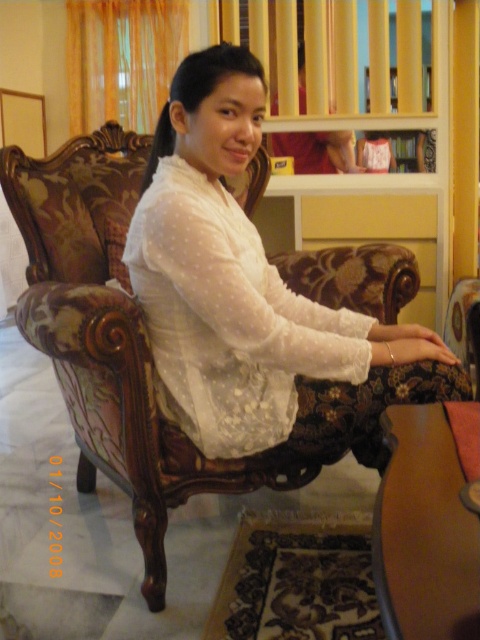
Question: Which of the following is the closest to the observer?

Choices:
 (A) wooden bookshelf at upper center
 (B) white sheer dress at center

Answer: (A)

Question: Among these points, which one is nearest to the camera?

Choices:
 (A) (287, 406)
 (B) (371, 163)
 (C) (392, 108)

Answer: (A)

Question: Can you confirm if wooden bookshelf at upper center is positioned to the left of white sheer dress at center?

Choices:
 (A) yes
 (B) no

Answer: (B)

Question: Which of the following is the farthest from the observer?

Choices:
 (A) (406, 156)
 (B) (186, 193)
 (C) (372, 157)

Answer: (C)

Question: Is white sheer blouse at center bigger than white sheer dress at center?

Choices:
 (A) no
 (B) yes

Answer: (B)

Question: In this image, where is wooden bookshelf at upper center located relative to white sheer dress at center?

Choices:
 (A) above
 (B) below

Answer: (A)